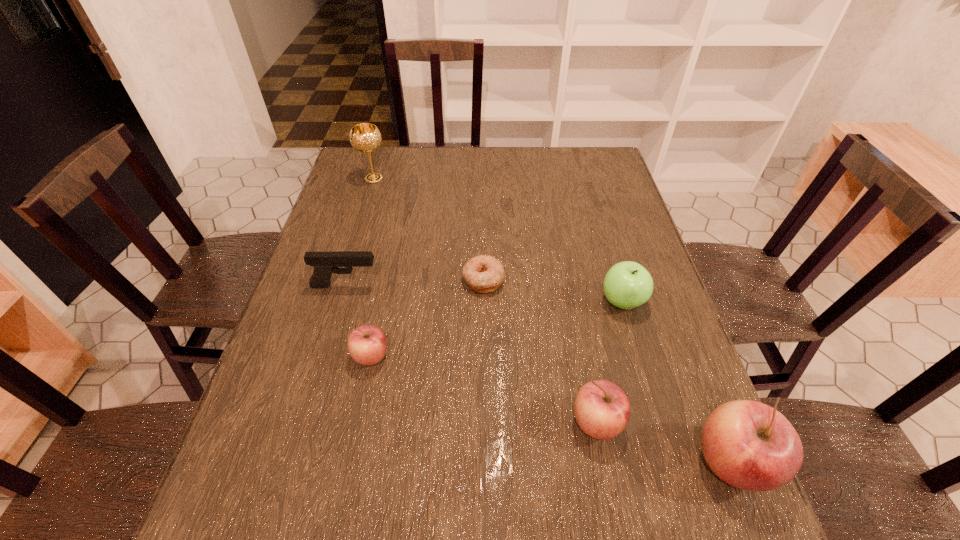
Locate an element on the screen. Image resolution: width=960 pixels, height=540 pixels. free point located on the back of the fifth object from left to right is located at coordinates (573, 303).

Locate an element on the screen. The image size is (960, 540). blank area located 0.190m on the left of the tallest apple is located at coordinates coord(589,463).

Where is `free location located 0.360m on the front of the chalice`? Image resolution: width=960 pixels, height=540 pixels. free location located 0.360m on the front of the chalice is located at coordinates (348, 264).

The width and height of the screenshot is (960, 540). I want to click on vacant area located 0.270m on the left of the farthest apple, so click(x=492, y=302).

Locate an element on the screen. This screenshot has width=960, height=540. free space located on the front of the doughnut is located at coordinates (484, 410).

This screenshot has height=540, width=960. In order to click on vacant space situated 0.120m on the front-facing side of the pistol in this screenshot , I will do `click(427, 286)`.

Locate an element on the screen. object at the far edge is located at coordinates (365, 137).

Locate an element on the screen. The width and height of the screenshot is (960, 540). chalice positioned at the left edge is located at coordinates (365, 137).

At what (x,y) coordinates should I click in order to perform the action: click on pistol positioned at the left edge. Please return your answer as a coordinate pair (x, y). Looking at the image, I should click on (324, 264).

This screenshot has width=960, height=540. I want to click on object that is at the far left corner, so click(x=365, y=137).